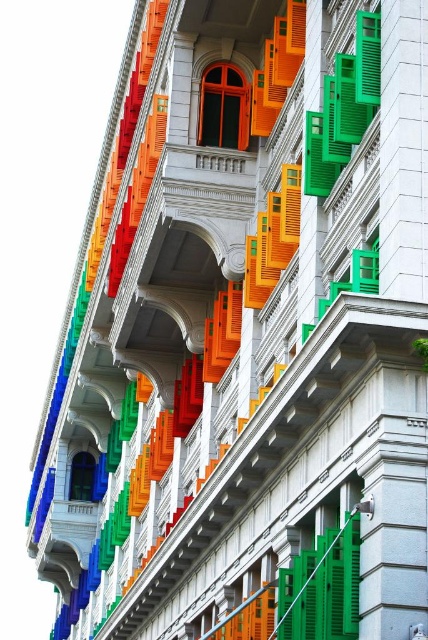
Question: Can you confirm if matte orange window at center is wider than blue glass window at center?

Choices:
 (A) yes
 (B) no

Answer: (A)

Question: Which point is closer to the camera?

Choices:
 (A) (94, 492)
 (B) (207, 77)

Answer: (B)

Question: Is matte orange window at center closer to the viewer compared to blue glass window at center?

Choices:
 (A) yes
 (B) no

Answer: (A)

Question: Which object appears farthest from the camera in this image?

Choices:
 (A) matte orange window at center
 (B) blue glass window at center

Answer: (B)

Question: Does matte orange window at center appear under blue glass window at center?

Choices:
 (A) yes
 (B) no

Answer: (B)